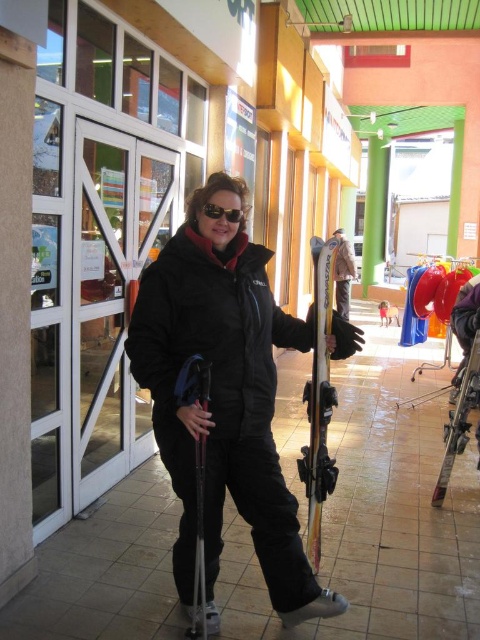
Consider the image. Can you confirm if black matte jacket at center is shorter than black reflective sunglasses at center?

In fact, black matte jacket at center may be taller than black reflective sunglasses at center.

Between black matte jacket at center and black reflective sunglasses at center, which one has more height?

Standing taller between the two is black matte jacket at center.

Does point (191, 305) lie behind point (224, 216)?

No, it is in front of (224, 216).

The height and width of the screenshot is (640, 480). I want to click on black matte jacket at center, so click(x=224, y=397).

Which of these two, black matte jacket at center or shiny metallic skis at center, stands shorter?

shiny metallic skis at center

Who is lower down, black matte jacket at center or shiny metallic skis at center?

shiny metallic skis at center

At what (x,y) coordinates should I click in order to perform the action: click on black matte jacket at center. Please return your answer as a coordinate pair (x, y). Looking at the image, I should click on (224, 397).

Is shiny metallic skis at center wider than black reflective sunglasses at center?

Correct, the width of shiny metallic skis at center exceeds that of black reflective sunglasses at center.

Is shiny metallic skis at center to the left of black reflective sunglasses at center from the viewer's perspective?

No, shiny metallic skis at center is not to the left of black reflective sunglasses at center.

Who is more forward, (312, 536) or (227, 211)?

Positioned in front is point (227, 211).

The image size is (480, 640). Identify the location of shiny metallic skis at center. (319, 400).